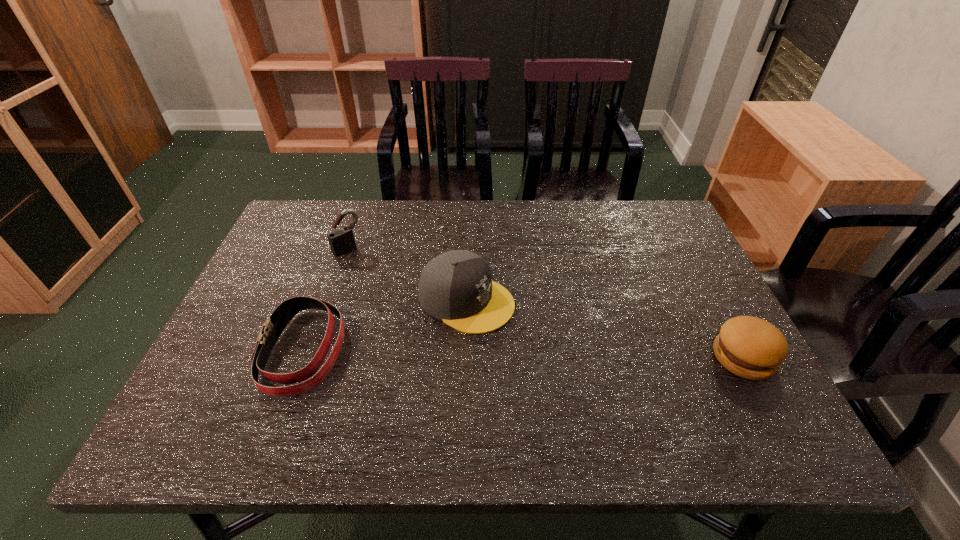
Find the location of `free space located 0.390m on the front-facing side of the third object from left to right`. free space located 0.390m on the front-facing side of the third object from left to right is located at coordinates (670, 398).

At what (x,y) coordinates should I click in order to perform the action: click on vacant space situated 0.110m on the front-facing side of the third object from left to right. Please return your answer as a coordinate pair (x, y). The height and width of the screenshot is (540, 960). Looking at the image, I should click on (548, 338).

Where is `object that is positioned at the far edge`? object that is positioned at the far edge is located at coordinates (341, 241).

This screenshot has width=960, height=540. Identify the location of dog collar at the near edge. (273, 327).

Where is `hamburger that is at the near edge`? Image resolution: width=960 pixels, height=540 pixels. hamburger that is at the near edge is located at coordinates (752, 348).

Locate an element on the screen. object at the left edge is located at coordinates (273, 327).

This screenshot has height=540, width=960. Find the location of `object present at the right edge`. object present at the right edge is located at coordinates (752, 348).

Where is `object located at the near left corner`? Image resolution: width=960 pixels, height=540 pixels. object located at the near left corner is located at coordinates (273, 327).

Locate an element on the screen. object positioned at the near right corner is located at coordinates (752, 348).

Image resolution: width=960 pixels, height=540 pixels. Find the location of `free space at the far edge`. free space at the far edge is located at coordinates (503, 231).